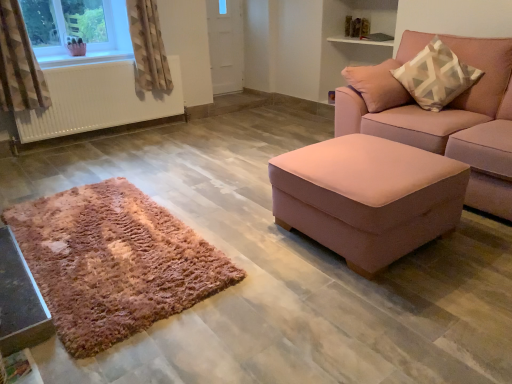
Question: Considering the relative sizes of white matte radiator at left and beige textured curtain at upper left, which is the 2th curtain in front-to-back order, in the image provided, is white matte radiator at left wider than beige textured curtain at upper left, which is the 2th curtain in front-to-back order,?

Choices:
 (A) no
 (B) yes

Answer: (A)

Question: Would you say white matte radiator at left is outside beige textured curtain at upper left, which is the 2th curtain in front-to-back order?

Choices:
 (A) no
 (B) yes

Answer: (B)

Question: Is white matte radiator at left facing towards beige textured curtain at upper left, which is the 2th curtain in front-to-back order?

Choices:
 (A) yes
 (B) no

Answer: (B)

Question: Can you confirm if white matte radiator at left is smaller than beige textured curtain at upper left, the first curtain viewed from the back?

Choices:
 (A) yes
 (B) no

Answer: (B)

Question: Is white matte radiator at left looking in the opposite direction of beige textured curtain at upper left, the first curtain viewed from the back?

Choices:
 (A) no
 (B) yes

Answer: (A)

Question: In terms of height, does white matte door at upper center look taller or shorter compared to shiny black table at lower left, which appears as the second table when viewed from the right?

Choices:
 (A) short
 (B) tall

Answer: (B)

Question: Considering the positions of white matte door at upper center and shiny black table at lower left, which appears as the second table when viewed from the right, in the image, is white matte door at upper center wider or thinner than shiny black table at lower left, which appears as the second table when viewed from the right,?

Choices:
 (A) wide
 (B) thin

Answer: (B)

Question: Which is correct: white matte door at upper center is inside shiny black table at lower left, placed as the 1th table when sorted from left to right, or outside of it?

Choices:
 (A) inside
 (B) outside

Answer: (B)

Question: Considering the positions of point pyautogui.click(x=225, y=31) and point pyautogui.click(x=1, y=350), is point pyautogui.click(x=225, y=31) closer or farther from the camera than point pyautogui.click(x=1, y=350)?

Choices:
 (A) closer
 (B) farther

Answer: (B)

Question: From a real-world perspective, relative to white matte door at upper center, is shiny black table at lower left, placed as the 1th table when sorted from left to right, vertically above or below?

Choices:
 (A) above
 (B) below

Answer: (B)

Question: From their relative heights in the image, would you say shiny black table at lower left, placed as the 1th table when sorted from left to right, is taller or shorter than white matte door at upper center?

Choices:
 (A) tall
 (B) short

Answer: (B)

Question: Is shiny black table at lower left, which appears as the second table when viewed from the right, wider or thinner than white matte door at upper center?

Choices:
 (A) wide
 (B) thin

Answer: (A)

Question: Looking at the image, does shiny black table at lower left, placed as the 1th table when sorted from left to right, seem bigger or smaller compared to white matte door at upper center?

Choices:
 (A) small
 (B) big

Answer: (A)

Question: Considering the positions of point (223, 1) and point (0, 67), is point (223, 1) closer or farther from the camera than point (0, 67)?

Choices:
 (A) closer
 (B) farther

Answer: (B)

Question: Is white matte door at upper center taller or shorter than geometric patterned fabric curtain at upper left, which is the 2th curtain in right-to-left order?

Choices:
 (A) tall
 (B) short

Answer: (A)